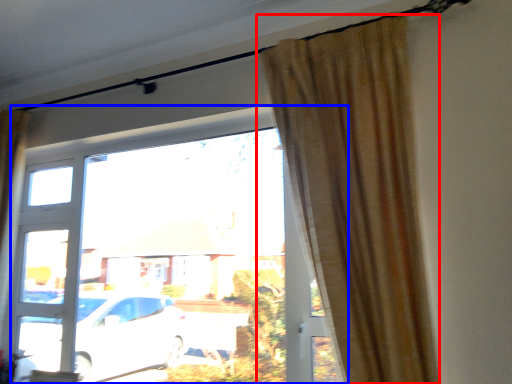
Question: Which object is closer to the camera taking this photo, curtain (highlighted by a red box) or window (highlighted by a blue box)?

Choices:
 (A) curtain
 (B) window

Answer: (A)